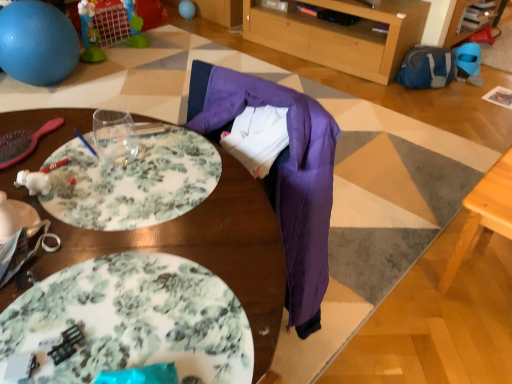
This screenshot has height=384, width=512. Identify the location of free point below light wood table at lower right, marked as the 2th table in a left-to-right arrangement (from a real-world perspective). (487, 276).